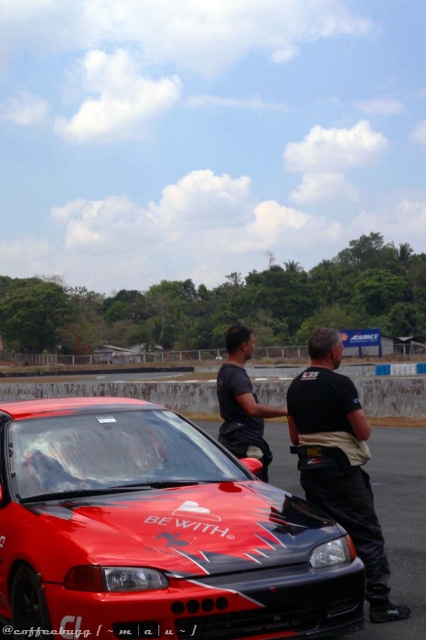
Does black leather jacket at center have a greater height compared to black plastic license plate at center?

Yes, black leather jacket at center is taller than black plastic license plate at center.

Which is behind, point (319, 497) or point (141, 621)?

Positioned behind is point (319, 497).

The width and height of the screenshot is (426, 640). What are the coordinates of `black leather jacket at center` in the screenshot? It's located at (339, 461).

Is the position of black leather jacket at center more distant than that of black matte shirt at center?

No, it is not.

Is black leather jacket at center closer to camera compared to black matte shirt at center?

Yes.

At what (x,y) coordinates should I click in order to perform the action: click on black leather jacket at center. Please return your answer as a coordinate pair (x, y). Looking at the image, I should click on (339, 461).

The image size is (426, 640). I want to click on black leather jacket at center, so (x=339, y=461).

Is point (247, 576) in front of point (140, 636)?

No, it is behind (140, 636).

Is shiny red car at center to the right of black plastic license plate at center from the viewer's perspective?

In fact, shiny red car at center is to the left of black plastic license plate at center.

Which is in front, point (75, 609) or point (120, 624)?

Positioned in front is point (120, 624).

Where is `shiny red car at center`? This screenshot has height=640, width=426. shiny red car at center is located at coordinates (157, 531).